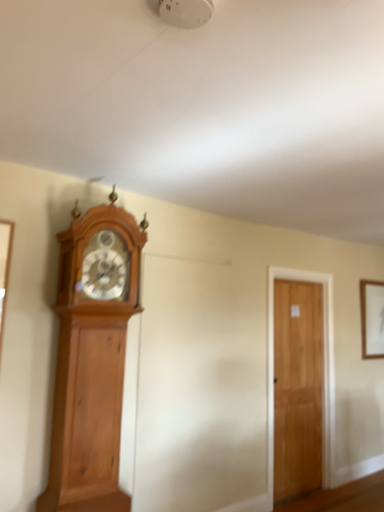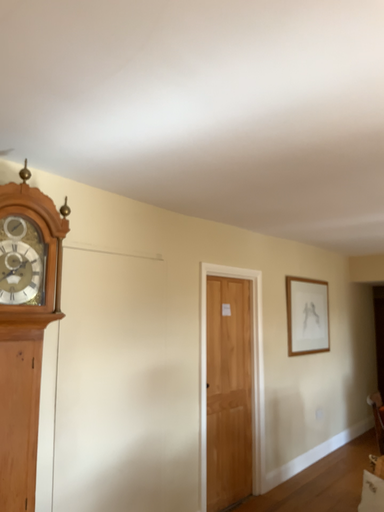
Question: Which way did the camera rotate in the video?

Choices:
 (A) rotated left
 (B) rotated right

Answer: (B)